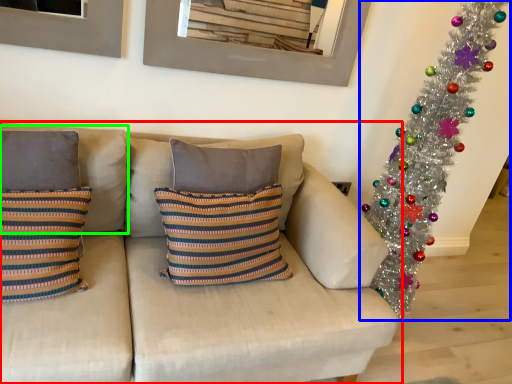
Question: Which object is the closest to the studio couch (highlighted by a red box)? Choose among these: christmas tree (highlighted by a blue box) or pillow (highlighted by a green box).

Choices:
 (A) christmas tree
 (B) pillow

Answer: (B)